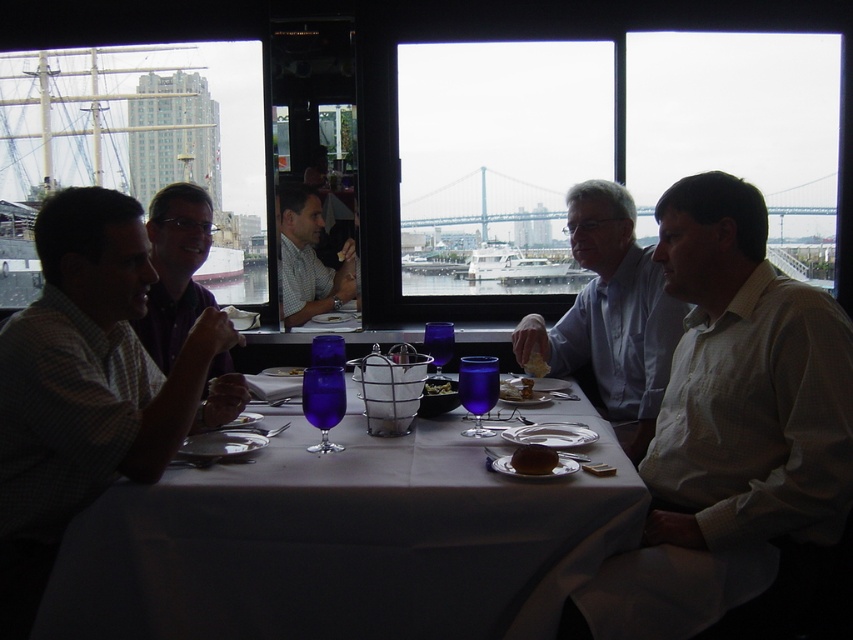
You are a waiter in a waterfront restaurant. You need to deliver a drink to the person wearing the white shirt at right and a basket of bread to the smooth brown bread at center. Which item should you place closer to the center of the table?

The smooth brown bread at center is already positioned at the center of the table, so you should place the basket of bread there. The drink for the white shirt at right should be placed to the right of the smooth brown bread at center, as the white shirt at right is located to the right of it.